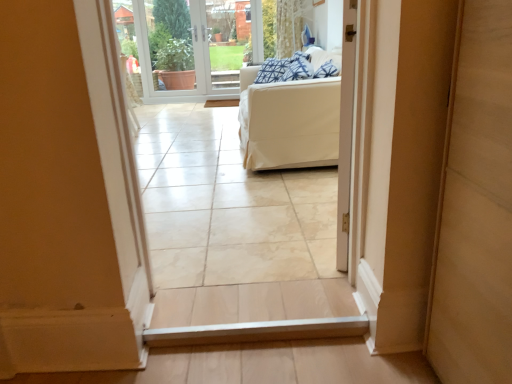
Question: Is transparent glass door at center behind white fabric couch at center?

Choices:
 (A) no
 (B) yes

Answer: (B)

Question: From a real-world perspective, is transparent glass door at center under white fabric couch at center?

Choices:
 (A) yes
 (B) no

Answer: (B)

Question: Is transparent glass door at center facing towards white fabric couch at center?

Choices:
 (A) yes
 (B) no

Answer: (A)

Question: Does transparent glass door at center come in front of white fabric couch at center?

Choices:
 (A) yes
 (B) no

Answer: (B)

Question: Is transparent glass door at center located outside white fabric couch at center?

Choices:
 (A) yes
 (B) no

Answer: (A)

Question: Considering the relative sizes of transparent glass door at center and white fabric couch at center in the image provided, is transparent glass door at center bigger than white fabric couch at center?

Choices:
 (A) no
 (B) yes

Answer: (A)

Question: Can you confirm if white fabric couch at center is shorter than white plastic window screen at upper center?

Choices:
 (A) no
 (B) yes

Answer: (B)

Question: Does white fabric couch at center lie in front of white plastic window screen at upper center?

Choices:
 (A) no
 (B) yes

Answer: (B)

Question: From a real-world perspective, is white fabric couch at center physically below white plastic window screen at upper center?

Choices:
 (A) no
 (B) yes

Answer: (B)

Question: Is the depth of white fabric couch at center greater than that of white plastic window screen at upper center?

Choices:
 (A) no
 (B) yes

Answer: (A)

Question: Considering the relative sizes of white fabric couch at center and white plastic window screen at upper center in the image provided, is white fabric couch at center thinner than white plastic window screen at upper center?

Choices:
 (A) no
 (B) yes

Answer: (A)

Question: Is white fabric couch at center beside white plastic window screen at upper center?

Choices:
 (A) no
 (B) yes

Answer: (A)

Question: Does blue patterned pillow at upper center come behind transparent glass door at center?

Choices:
 (A) yes
 (B) no

Answer: (B)